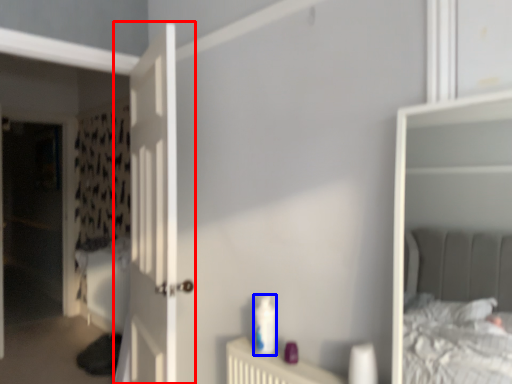
Question: Which point is further to the camera, door (highlighted by a red box) or toiletry (highlighted by a blue box)?

Choices:
 (A) door
 (B) toiletry

Answer: (A)